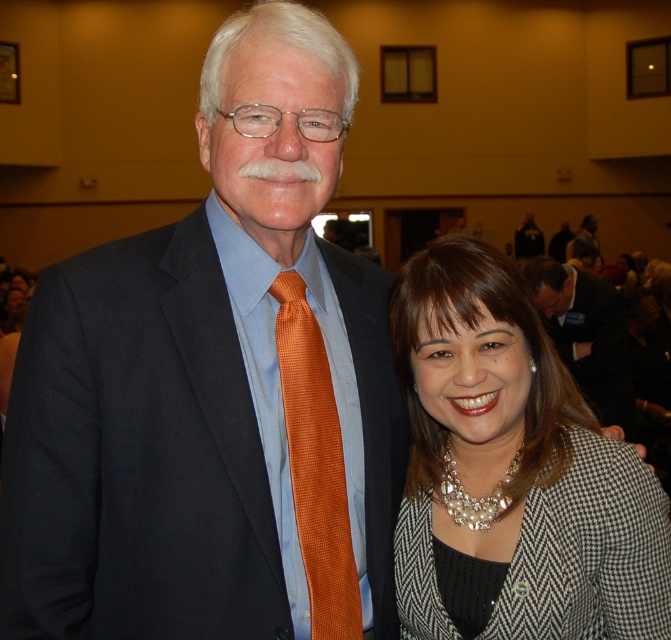
Question: Does orange silk tie at center have a larger size compared to matte black suit at center?

Choices:
 (A) yes
 (B) no

Answer: (B)

Question: Which point is farther to the camera?

Choices:
 (A) matte orange tie at center
 (B) matte black suit at center

Answer: (B)

Question: Where is orange silk tie at center located in relation to matte black suit at center in the image?

Choices:
 (A) below
 (B) above

Answer: (A)

Question: Which point is farther to the camera?

Choices:
 (A) (568, 362)
 (B) (295, 285)
 (C) (529, 228)
 (D) (361, 282)

Answer: (C)

Question: In this image, where is matte orange tie at center located relative to orange silk tie at center?

Choices:
 (A) above
 (B) below

Answer: (A)

Question: Among these objects, which one is nearest to the camera?

Choices:
 (A) dark suit at center
 (B) matte orange tie at center

Answer: (B)